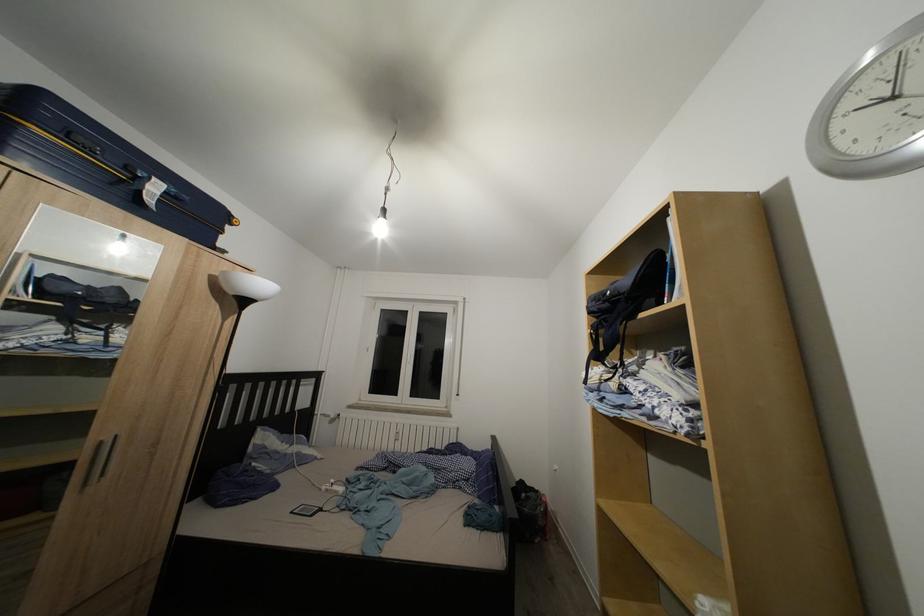
The location [306,509] corresponds to which object?

It refers to a white e-reader.